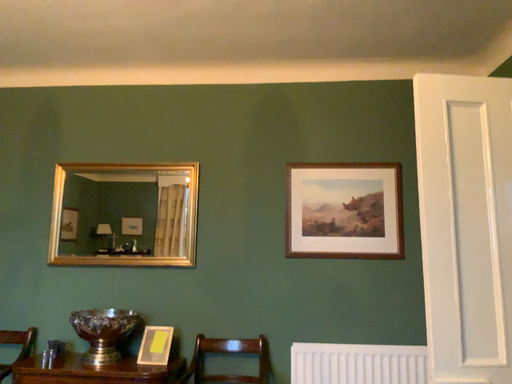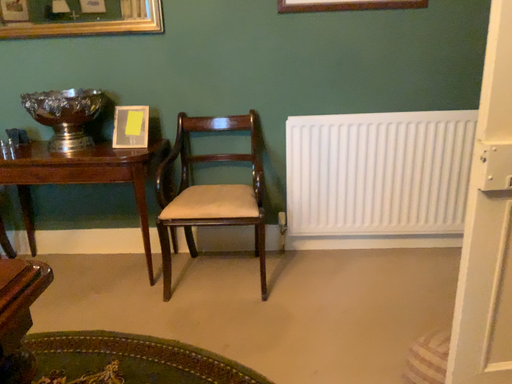
Question: Which way did the camera rotate in the video?

Choices:
 (A) rotated downward
 (B) rotated upward

Answer: (A)